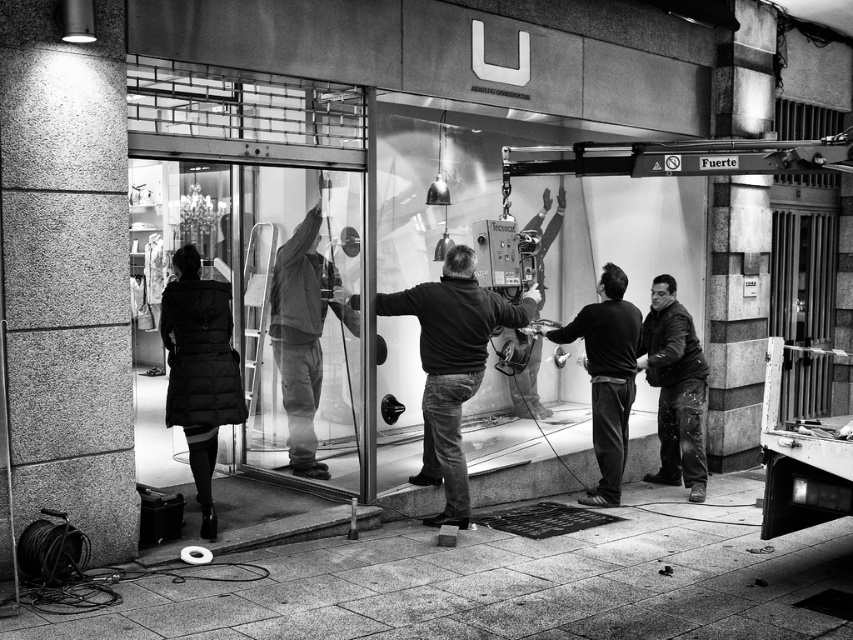
Which is behind, point (618, 477) or point (671, 292)?

The point (671, 292) is behind.

Does dark gray jeans at center appear on the left side of leather jacket at right?

Correct, you'll find dark gray jeans at center to the left of leather jacket at right.

Which is in front, point (618, 484) or point (689, 432)?

Point (618, 484)

The width and height of the screenshot is (853, 640). I want to click on dark gray jeans at center, so click(x=607, y=376).

From the picture: Can you confirm if dark gray sweater at center is bigger than matte black coat at lower left?

Yes, dark gray sweater at center is bigger than matte black coat at lower left.

Does dark gray sweater at center appear over matte black coat at lower left?

No, dark gray sweater at center is not above matte black coat at lower left.

Is point (454, 276) farther from camera compared to point (189, 336)?

Yes.

The image size is (853, 640). I want to click on dark gray sweater at center, so click(451, 364).

Which is above, dark gray sweater at center or leather jacket at right?

dark gray sweater at center

Who is shorter, dark gray sweater at center or leather jacket at right?

Standing shorter between the two is leather jacket at right.

Does point (457, 387) come in front of point (685, 364)?

Yes, point (457, 387) is in front of point (685, 364).

Where is `dark gray sweater at center`? dark gray sweater at center is located at coordinates (451, 364).